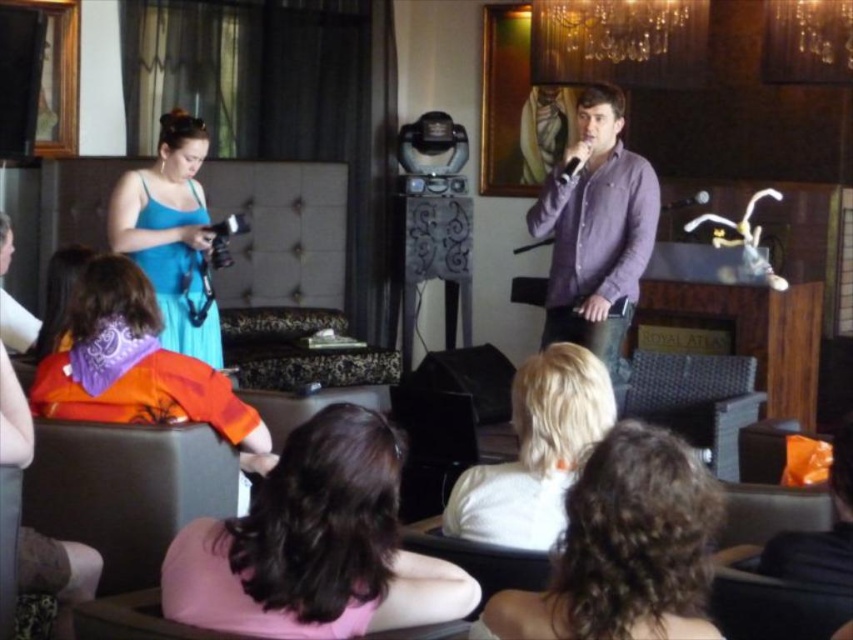
You are a photographer taking a picture of the purple cotton shirt at upper right and the white matte hair at center. Which object should you focus on first if you want to capture both in sharp focus?

The purple cotton shirt at upper right is taller than the white matte hair at center, so you should focus on the purple cotton shirt at upper right first to ensure both are in sharp focus.